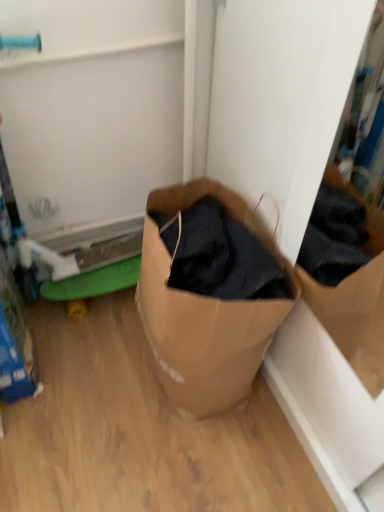
You are a GUI agent. You are given a task and a screenshot of the screen. Output one action in this format:
    pyautogui.click(x=<x>, y=<y>)
    Task: Click on the vacant region in front of brown paper bag at center
    The image size is (384, 512).
    Given the screenshot: What is the action you would take?
    pyautogui.click(x=187, y=458)